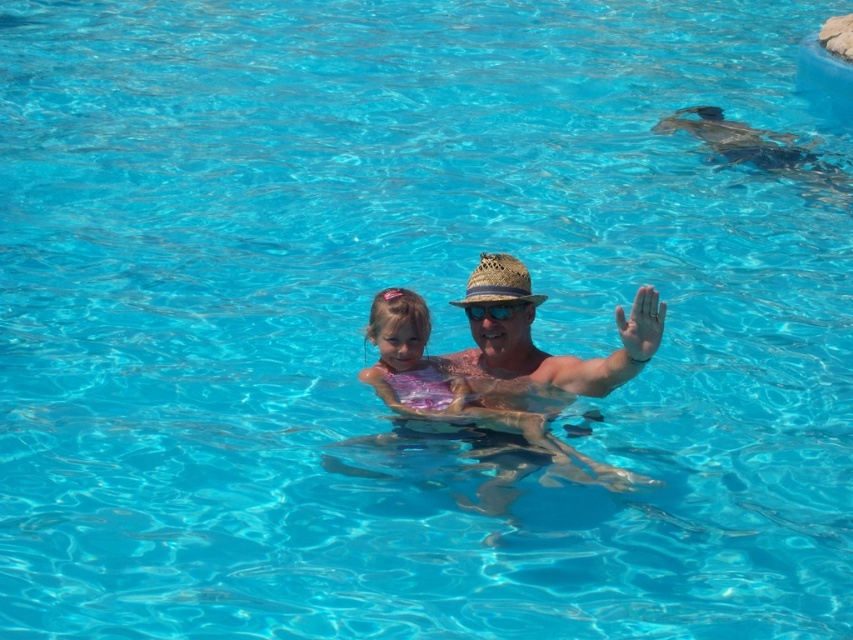
You are a photographer standing at the edge of the pool. You want to take a photo of two points in the pool. The first point is point (x=500, y=301) and the second point is point (x=643, y=308). Which point is closer to you?

Point (x=500, y=301) is closer to you because it is further to the viewer than point (x=643, y=308).

You are a photographer trying to capture a closeup of the blue reflective plastic goggles at center. However, there is a matte skin palm at upper right blocking your view. Can you adjust your position to get a clear shot of the goggles without the palm obstructing it?

The matte skin palm at upper right is closer to the viewer than the blue reflective plastic goggles at center. To avoid the obstruction, move your camera position slightly to the left or right so that the palm no longer blocks the view of the goggles.

You are a photographer trying to capture a candid shot of the man and girl in the pool. You notice the straw hat at center and the matte skin palm at upper right. Which object is positioned higher in the image?

The straw hat at center is above the matte skin palm at upper right, so the straw hat at center is higher in the image.